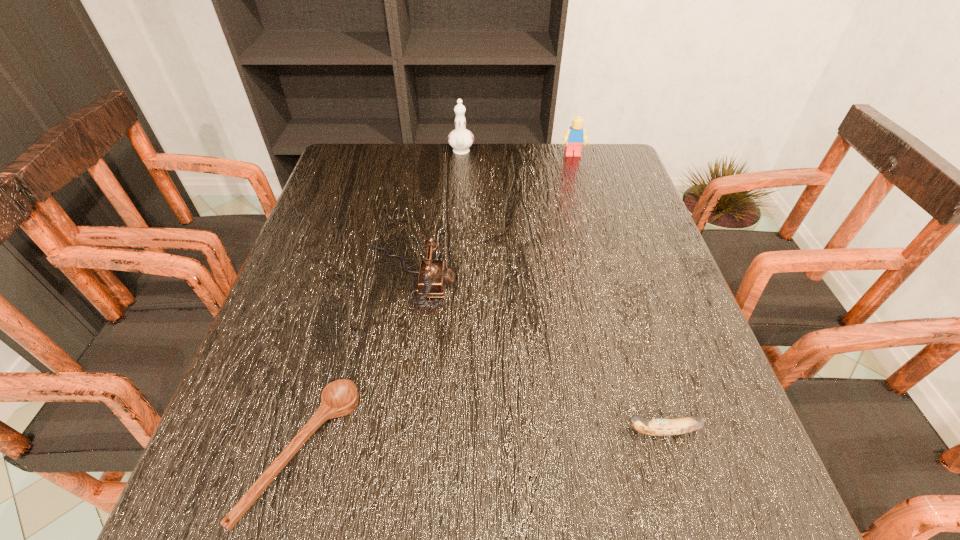
Where is `the tallest object`? This screenshot has height=540, width=960. the tallest object is located at coordinates (460, 139).

Find the location of a particular element. The height and width of the screenshot is (540, 960). the second tallest object is located at coordinates (575, 136).

Where is `the third tallest object`? the third tallest object is located at coordinates (432, 279).

Identify the location of the third farthest object. [432, 279].

Identify the location of banana. The image size is (960, 540). (654, 427).

You are a GUI agent. You are given a task and a screenshot of the screen. Output one action in this format:
    pyautogui.click(x=<x>, y=<y>)
    Task: Click on the shortest object
    The image size is (960, 540).
    Given the screenshot: What is the action you would take?
    pyautogui.click(x=339, y=398)

Where is `blank space located 0.350m at the spout of the chinaware`? blank space located 0.350m at the spout of the chinaware is located at coordinates (456, 239).

You are a GUI agent. You are given a task and a screenshot of the screen. Output one action in this format:
    pyautogui.click(x=<x>, y=<y>)
    Task: Click on the vacant position located 0.120m on the front-facing side of the second tallest object
    The width and height of the screenshot is (960, 540).
    Given the screenshot: What is the action you would take?
    pyautogui.click(x=580, y=182)

Image resolution: width=960 pixels, height=540 pixels. In order to click on free space located on the dial of the telephone in this screenshot , I will do `click(606, 278)`.

This screenshot has height=540, width=960. Find the location of `vacant space situated on the peel of the banana`. vacant space situated on the peel of the banana is located at coordinates (569, 431).